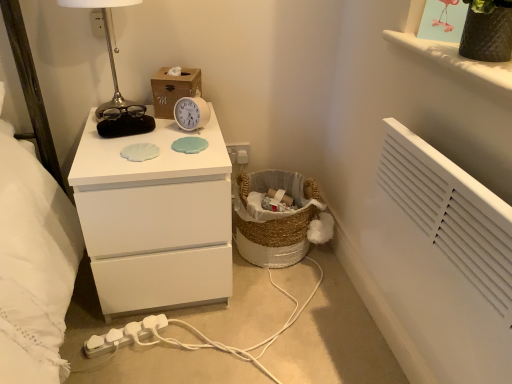
Image resolution: width=512 pixels, height=384 pixels. I want to click on free space in front of white plastic alarm clock at center, so click(x=178, y=153).